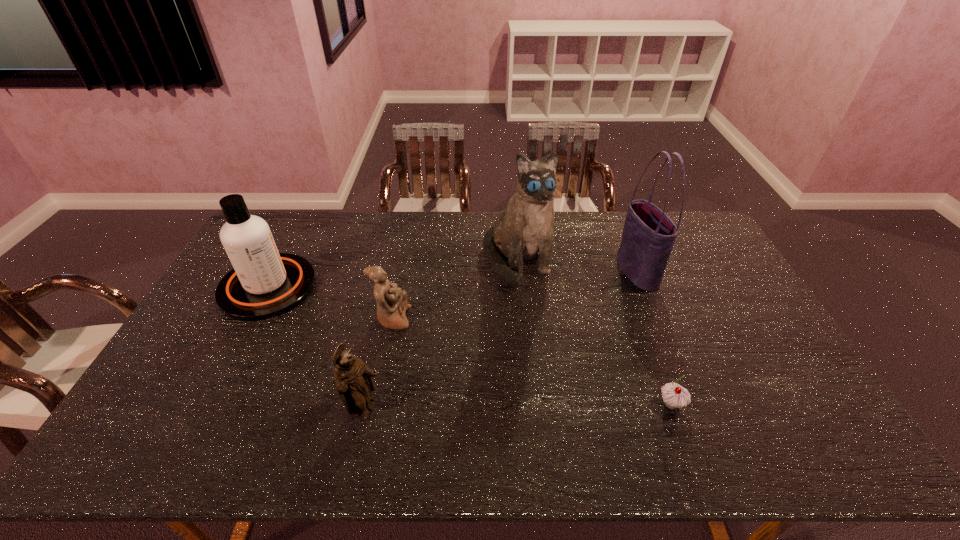
Image resolution: width=960 pixels, height=540 pixels. I want to click on free region located 0.230m on the front-facing side of the nearer figurine, so click(x=476, y=409).

Locate an element on the screen. vacant space located 0.170m on the front-facing side of the farther figurine is located at coordinates (467, 319).

Identify the location of blank space located 0.080m on the front of the shortest object. tap(686, 446).

Where is `object present at the far edge`? The height and width of the screenshot is (540, 960). object present at the far edge is located at coordinates (523, 232).

Identify the location of object that is at the left edge. This screenshot has width=960, height=540. (263, 284).

I want to click on free region at the far edge of the desktop, so click(333, 228).

You are a GUI agent. You are given a task and a screenshot of the screen. Output one action in this format:
    pyautogui.click(x=<x>, y=<y>)
    Task: Click on the free space at the near edge
    Image resolution: width=960 pixels, height=540 pixels.
    Given the screenshot: What is the action you would take?
    pyautogui.click(x=336, y=439)

Where is `free region at the right edge`? The height and width of the screenshot is (540, 960). free region at the right edge is located at coordinates (708, 295).

Where is `vacant point located between the farther figurine and the nearer figurine`? The image size is (960, 540). vacant point located between the farther figurine and the nearer figurine is located at coordinates (379, 364).

At what (x,y) coordinates should I click in order to perform the action: click on empty space that is in between the third object from right to left and the farther figurine. Please return your answer as a coordinate pair (x, y). Looking at the image, I should click on (455, 289).